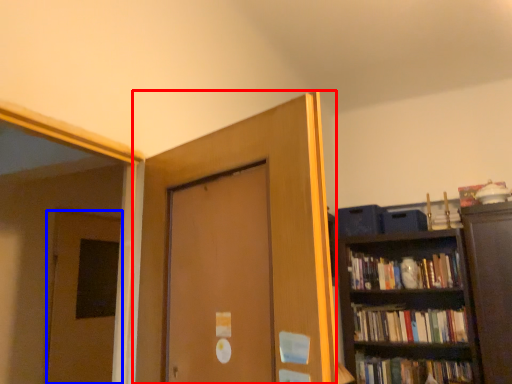
Question: Which object is further to the camera taking this photo, door (highlighted by a red box) or door (highlighted by a blue box)?

Choices:
 (A) door
 (B) door

Answer: (B)